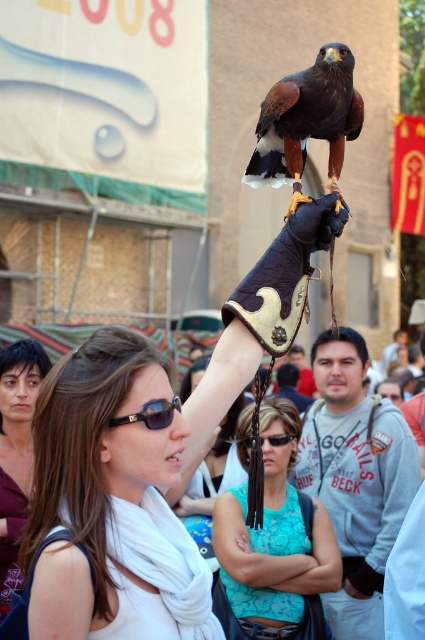
Does matte burgundy blouse at left appear on the right side of black plastic sunglasses at upper center?

In fact, matte burgundy blouse at left is to the left of black plastic sunglasses at upper center.

You are a GUI agent. You are given a task and a screenshot of the screen. Output one action in this format:
    pyautogui.click(x=<x>, y=<y>)
    Task: Click on the matte burgundy blouse at left
    
    Given the screenshot: What is the action you would take?
    pyautogui.click(x=16, y=451)

The image size is (425, 640). What are the coordinates of `matte burgundy blouse at left` in the screenshot? It's located at (16, 451).

Between matte teal tank top at center and black plastic sunglasses at upper center, which one appears on the left side from the viewer's perspective?

black plastic sunglasses at upper center

Does matte teal tank top at center appear on the left side of black plastic sunglasses at upper center?

In fact, matte teal tank top at center is to the right of black plastic sunglasses at upper center.

Is point (238, 554) positioned after point (147, 403)?

Yes, it is.

Where is `matte teal tank top at center`? matte teal tank top at center is located at coordinates 274,540.

What do you see at coordinates (306, 120) in the screenshot? I see `brown feathered falcon at center` at bounding box center [306, 120].

Is brown feathered falcon at center below black leather goggles at upper center?

Actually, brown feathered falcon at center is above black leather goggles at upper center.

Who is more forward, (263, 108) or (286, 442)?

Point (263, 108) is in front.

Where is `brown feathered falcon at center`? The width and height of the screenshot is (425, 640). brown feathered falcon at center is located at coordinates (306, 120).